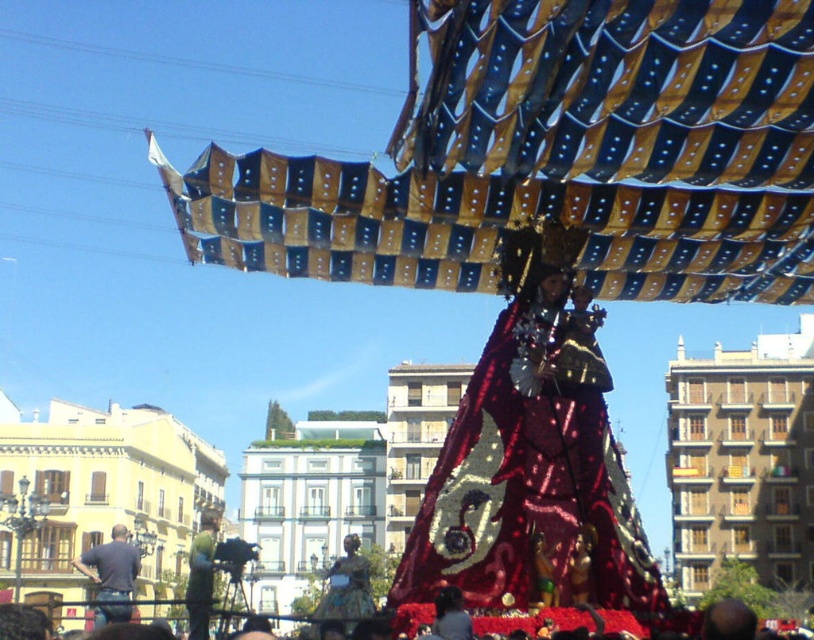
You are a photographer trying to capture the float in the religious procession. You notice the shiny red fabric at center and the green fabric costume at center. Which fabric should you focus on to ensure it appears larger in your photo?

The shiny red fabric at center is closer to the viewer than the green fabric costume at center, so focusing on the shiny red fabric at center will make it appear larger in the photo.

You are a photographer trying to capture the entire scene of the religious procession. You notice two elements in the foreground that might block your view. The dark blue jeans at lower left and the green fabric costume at center. Which of these two objects is smaller and therefore less likely to obstruct your shot?

The dark blue jeans at lower left has a smaller size compared to the green fabric costume at center, so it is less likely to obstruct your shot.

You are a photographer taking a picture of the float in the religious procession. You notice two points marked on your camera screen at coordinates point (130, 612) and point (208, 636). Which point is closer to your camera lens?

Point (130, 612) is further to the camera than point (208, 636), so the point closer to the camera lens is point (208, 636).